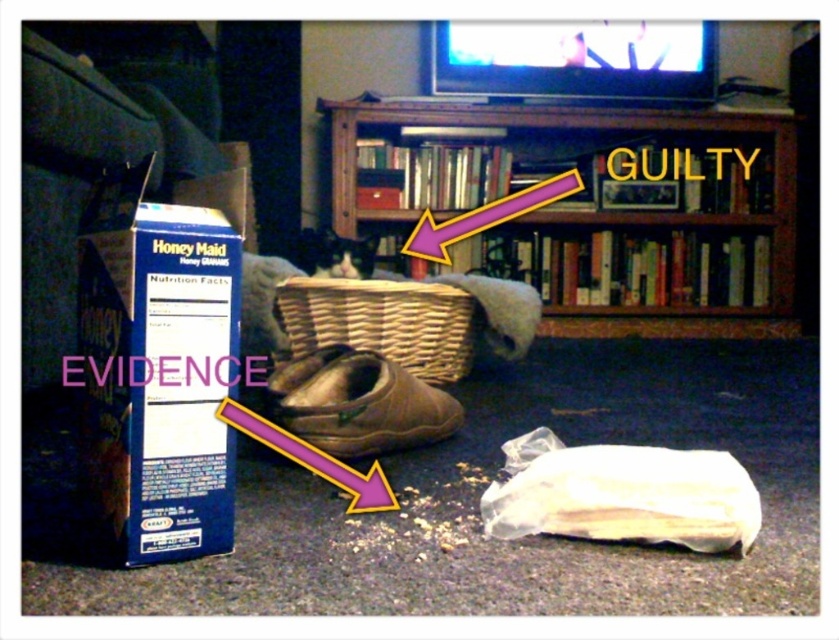
You are trying to decide whether to place a large decorative item between the wooden bookcase at upper center and the woven brown basket at center. Based on their widths, can you determine if there will be enough space?

The wooden bookcase at upper center might be wider than woven brown basket at center, so placing a large decorative item between them may not be feasible due to the potential width of the bookcase.

You are standing in the living room and want to place a new book on the wooden bookcase at upper center. According to the coordinates given, where exactly should you place the book?

The wooden bookcase at upper center is located at coordinates point (590, 205), so you should place the book there.